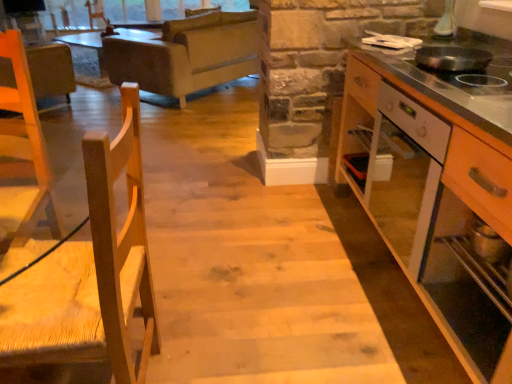
Question: Is light gray fabric couch at upper center to the left or to the right of brown leather armchair at upper left in the image?

Choices:
 (A) left
 (B) right

Answer: (B)

Question: Does point (188, 39) appear closer or farther from the camera than point (45, 61)?

Choices:
 (A) farther
 (B) closer

Answer: (A)

Question: Based on their relative distances, which object is farther from the black matte pan at upper right?

Choices:
 (A) wooden cabinet at right
 (B) brown leather armchair at upper left
 (C) natural wood chair at left
 (D) light gray fabric couch at upper center

Answer: (B)

Question: Which of these objects is positioned closest to the natural wood chair at left?

Choices:
 (A) brown leather armchair at upper left
 (B) black matte pan at upper right
 (C) light gray fabric couch at upper center
 (D) wooden cabinet at right

Answer: (D)